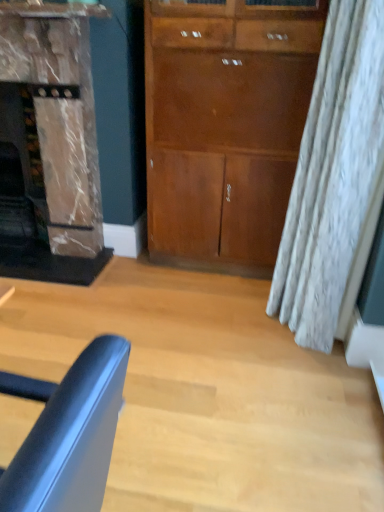
In order to click on vacant space in front of matte wood cabinet at center in this screenshot , I will do `click(228, 315)`.